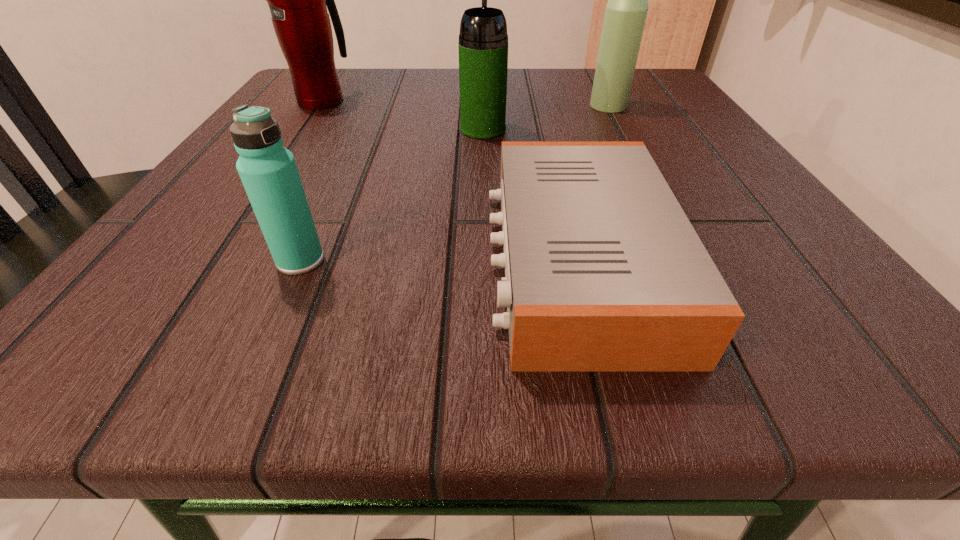
Where is `free spot at the far edge of the desktop`? free spot at the far edge of the desktop is located at coordinates (427, 95).

In the image, there is a desktop. What are the coordinates of `vacant region at the near edge` in the screenshot? It's located at (498, 329).

This screenshot has width=960, height=540. Identify the location of free point at the left edge. (331, 138).

In order to click on vacant region at the right edge of the desktop in this screenshot , I will do `click(620, 136)`.

In the image, there is a desktop. Where is `vacant area at the far right corner`? The image size is (960, 540). vacant area at the far right corner is located at coordinates (665, 93).

At what (x,y) coordinates should I click in order to perform the action: click on free area in between the leftmost object and the third farthest thermos bottle. Please return your answer as a coordinate pair (x, y). Image resolution: width=960 pixels, height=540 pixels. Looking at the image, I should click on (403, 115).

Where is `unoccupied area between the leftmost thermos bottle and the shortest object`? This screenshot has height=540, width=960. unoccupied area between the leftmost thermos bottle and the shortest object is located at coordinates (450, 181).

I want to click on free space between the leftmost thermos bottle and the third farthest thermos bottle, so click(x=403, y=115).

The image size is (960, 540). Identify the location of vacant area between the second thermos bottle from right to left and the leftmost object. (403, 115).

Image resolution: width=960 pixels, height=540 pixels. I want to click on vacant point located between the third farthest object and the leftmost thermos bottle, so click(403, 115).